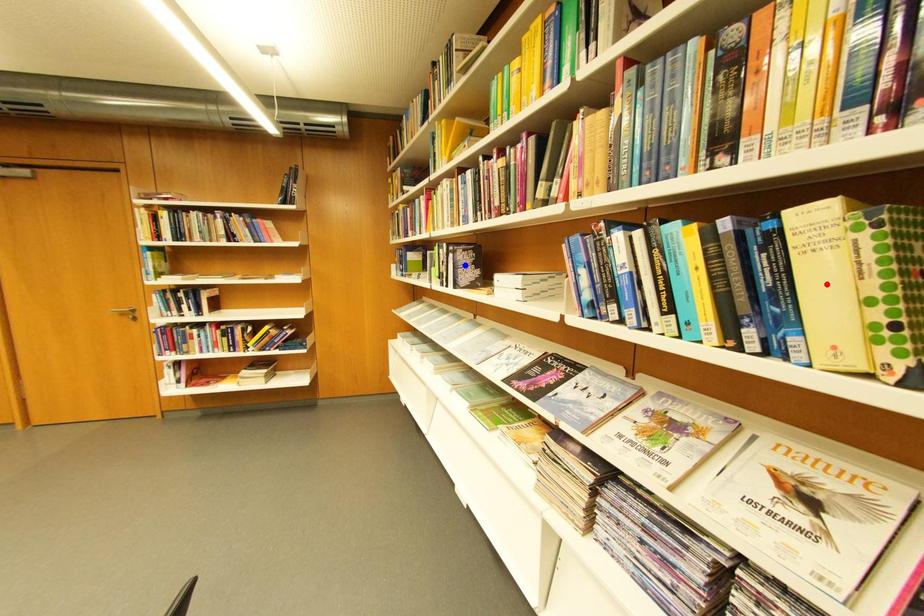
Question: In the image, two points are highlighted. Which point is nearer to the camera? Reply with the corresponding letter.

Choices:
 (A) blue point
 (B) red point

Answer: (B)